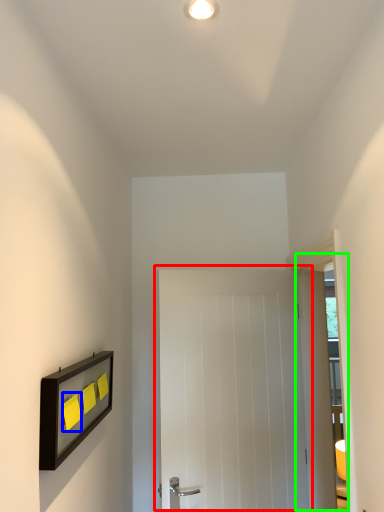
Question: Estimate the real-world distances between objects in this image. Which object is closer to door (highlighted by a red box), light switch (highlighted by a blue box) or glass door (highlighted by a green box)?

Choices:
 (A) light switch
 (B) glass door

Answer: (B)